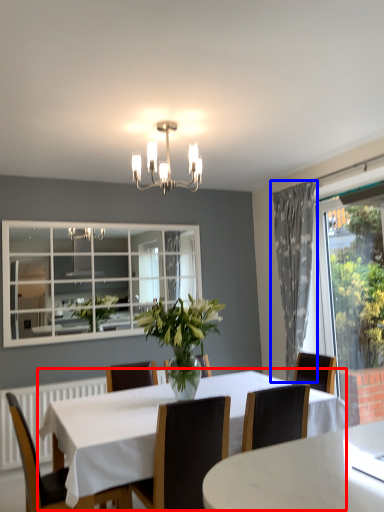
Question: Among these objects, which one is nearest to the camera, kitchen & dining room table (highlighted by a red box) or curtain (highlighted by a blue box)?

Choices:
 (A) kitchen & dining room table
 (B) curtain

Answer: (A)